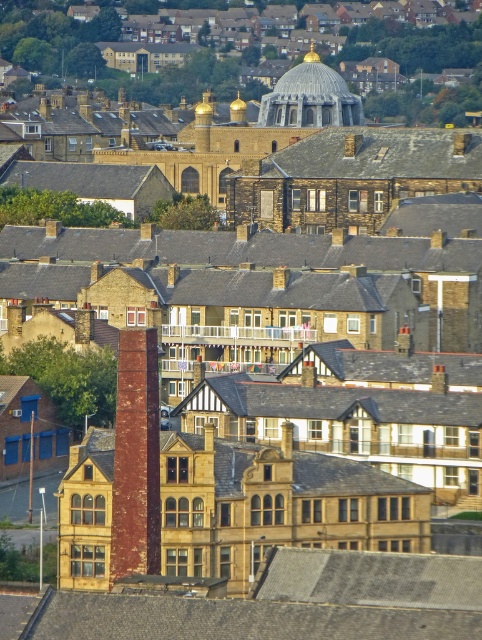
You are an urban planner analyzing the skyline of this city. You notice the red brick chimney at center and the silver metallic dome at center. Which structure is positioned lower in the scene?

The red brick chimney at center is located below the silver metallic dome at center, so it is positioned lower in the scene.

You are a city planner reviewing this urban layout. The red brick chimney at center is part of a new construction project. To ensure compliance with zoning laws, you need to confirm its location relative to the city grid. Is the chimney positioned at the specified coordinates of point 0.717, 0.282?

Yes, the red brick chimney at center is located exactly at point (x=135, y=458) as per the provided description, so it complies with the zoning requirements.